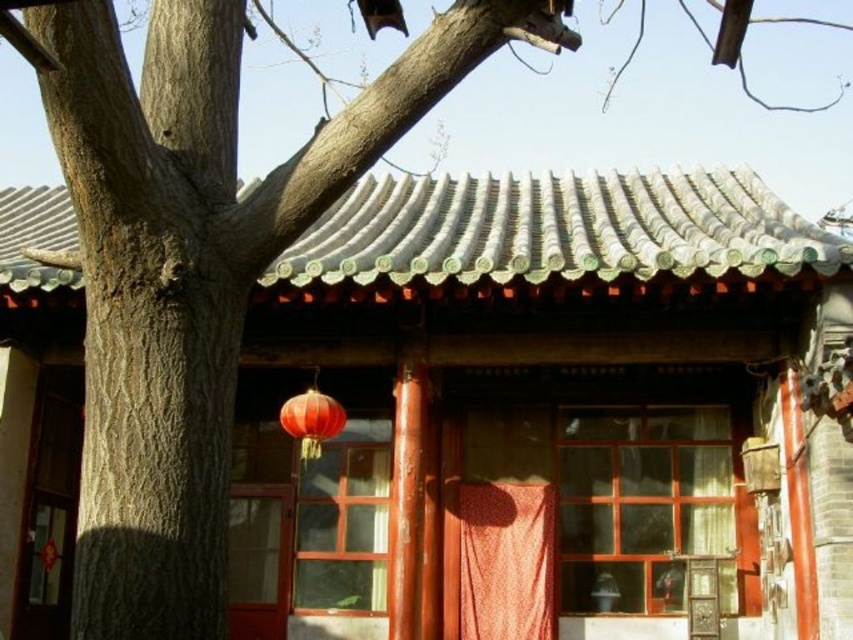
You are standing in front of a traditional Chinese courtyard house with two points marked on its roof. The first point is at coordinates point (474,566) and the second point is at point (276,627). Which of these two points on the roof is closer to you?

Point (474,566) is closer to the viewer than point (276,627).